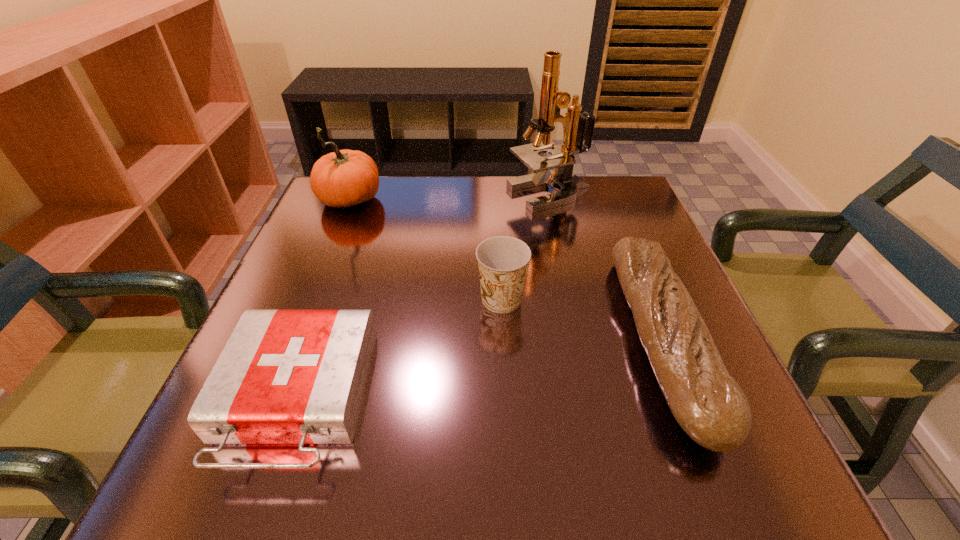
Locate an element on the screen. The height and width of the screenshot is (540, 960). microscope is located at coordinates (562, 158).

Where is `the fourth shortest object`? The image size is (960, 540). the fourth shortest object is located at coordinates (343, 178).

This screenshot has height=540, width=960. In order to click on the third shortest object in this screenshot , I will do `click(502, 260)`.

At what (x,y) coordinates should I click in order to perform the action: click on baguet. Please return your answer as a coordinate pair (x, y). This screenshot has width=960, height=540. Looking at the image, I should click on (709, 405).

Where is `the first-aid kit`? This screenshot has height=540, width=960. the first-aid kit is located at coordinates (284, 376).

Identify the location of vacant space situated 0.150m at the eyepiece of the microscope. (448, 195).

Image resolution: width=960 pixels, height=540 pixels. I want to click on vacant area located at the eyepiece of the microscope, so click(x=480, y=195).

Where is `free space located 0.380m at the eyepiece of the microscope`? free space located 0.380m at the eyepiece of the microscope is located at coordinates (359, 195).

Locate an element on the screen. free space located on the right of the fourth shortest object is located at coordinates (537, 201).

Find the location of a particular element. Image resolution: width=960 pixels, height=540 pixels. vacant space located 0.260m on the right of the Dixie cup is located at coordinates (661, 300).